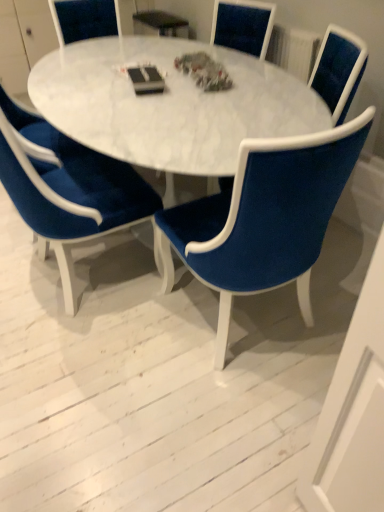
Find the location of `free point above white marble table at center (from a real-world perspective)`. free point above white marble table at center (from a real-world perspective) is located at coordinates (111, 77).